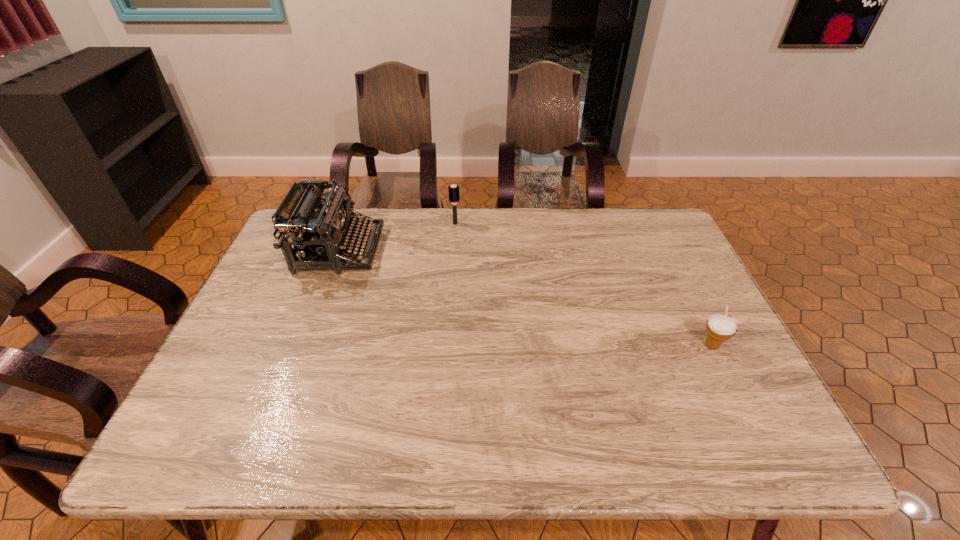
At what (x,y) coordinates should I click in order to perform the action: click on the leftmost object. Please return your answer as a coordinate pair (x, y). This screenshot has height=540, width=960. Looking at the image, I should click on (315, 234).

Image resolution: width=960 pixels, height=540 pixels. What are the coordinates of `typewriter` in the screenshot? It's located at (315, 234).

Locate an element on the screen. The height and width of the screenshot is (540, 960). the second object from right to left is located at coordinates (453, 190).

The width and height of the screenshot is (960, 540). I want to click on the second tallest object, so click(x=453, y=190).

At what (x,y) coordinates should I click in order to perform the action: click on the shortest object. Please return your answer as a coordinate pair (x, y). Looking at the image, I should click on (719, 327).

I want to click on the rightmost object, so click(719, 327).

What are the coordinates of `vacant space located on the typing side of the typewriter` in the screenshot? It's located at (433, 250).

The width and height of the screenshot is (960, 540). I want to click on vacant region located on the right of the second object from left to right, so click(x=579, y=224).

Where is `free point located 0.170m on the back of the nearest object`? The width and height of the screenshot is (960, 540). free point located 0.170m on the back of the nearest object is located at coordinates (683, 287).

You are a GUI agent. You are given a task and a screenshot of the screen. Output one action in this format:
    pyautogui.click(x=<x>, y=<y>)
    Task: Click on the typewriter that is at the far edge
    
    Given the screenshot: What is the action you would take?
    pyautogui.click(x=315, y=234)